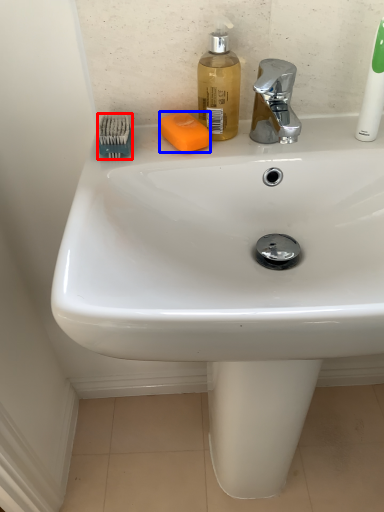
Question: Which of the following is the farthest to the observer, brush (highlighted by a red box) or soap (highlighted by a blue box)?

Choices:
 (A) brush
 (B) soap

Answer: (B)